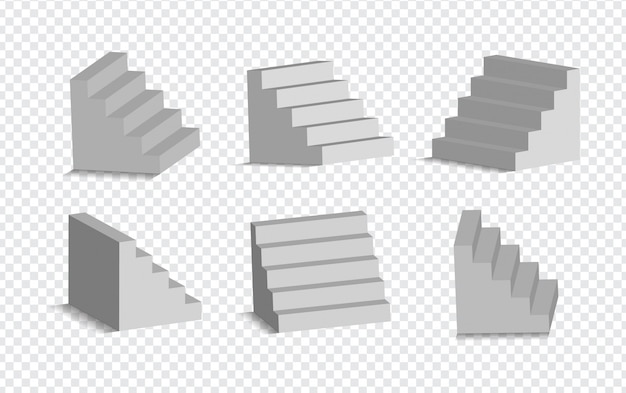
I want to click on staircases, so click(119, 104), click(308, 116), click(504, 103), click(486, 291), click(317, 283), click(136, 285).